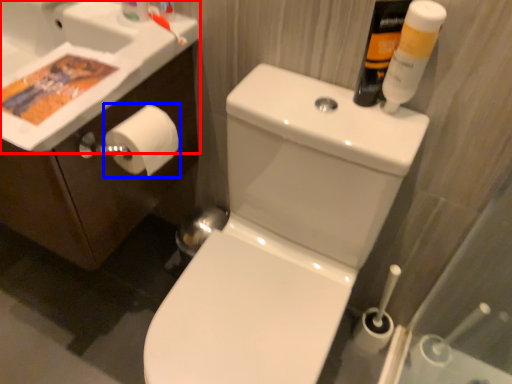
Question: Which point is further to the camera, sink (highlighted by a red box) or toilet paper (highlighted by a blue box)?

Choices:
 (A) sink
 (B) toilet paper

Answer: (B)